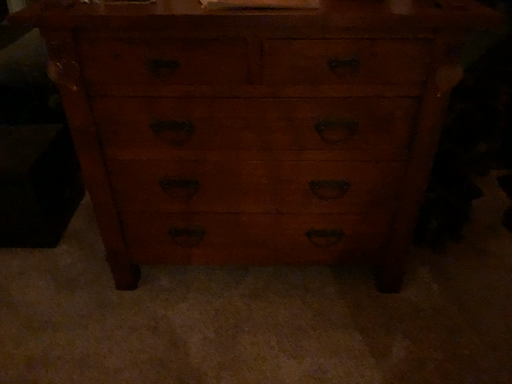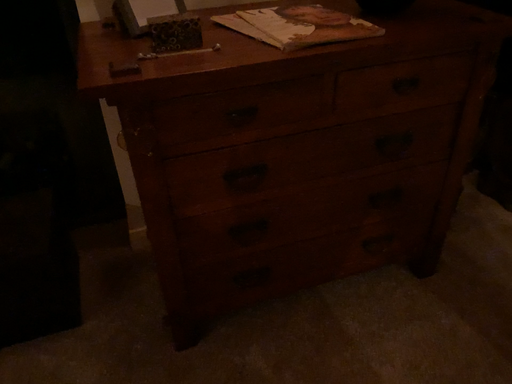
Question: How did the camera likely rotate when shooting the video?

Choices:
 (A) rotated right
 (B) rotated left

Answer: (A)